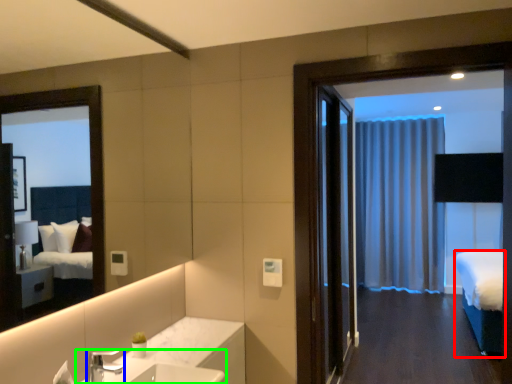
Question: Which object is positioned farthest from bed (highlighted by a red box)? Select from tap (highlighted by a blue box) and sink (highlighted by a green box).

Choices:
 (A) tap
 (B) sink

Answer: (A)